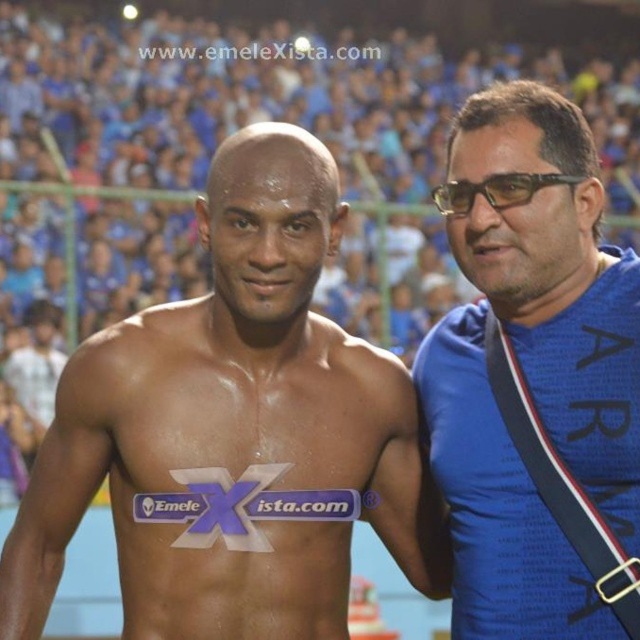
Is shiny skin torso at center to the right of black plastic glasses at right from the viewer's perspective?

A: No, shiny skin torso at center is not to the right of black plastic glasses at right.

Who is more forward, (74,433) or (440,209)?

Point (74,433) is more forward.

What are the coordinates of `shiny skin torso at center` in the screenshot? It's located at (234, 433).

Does blue fabric shirt at right come behind black plastic glasses at right?

No.

Looking at this image, can you confirm if blue fabric shirt at right is wider than black plastic glasses at right?

Yes, blue fabric shirt at right is wider than black plastic glasses at right.

Between point (438, 364) and point (531, 179), which one is positioned in front?

Point (531, 179)

Locate an element on the screen. The image size is (640, 640). blue fabric shirt at right is located at coordinates (534, 380).

Between point (26, 532) and point (602, 339), which one is positioned in front?

Point (26, 532) is in front.

Is shiny skin torso at center taller than blue fabric shirt at right?

No, shiny skin torso at center is not taller than blue fabric shirt at right.

Which is behind, point (374, 470) or point (602, 577)?

The point (374, 470) is more distant.

Image resolution: width=640 pixels, height=640 pixels. In order to click on shiny skin torso at center in this screenshot , I will do `click(234, 433)`.